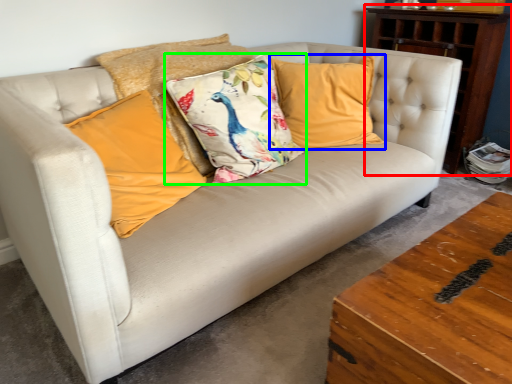
Question: Considering the real-world distances, which object is closest to dresser (highlighted by a red box)? pillow (highlighted by a blue box) or pillow (highlighted by a green box).

Choices:
 (A) pillow
 (B) pillow

Answer: (A)